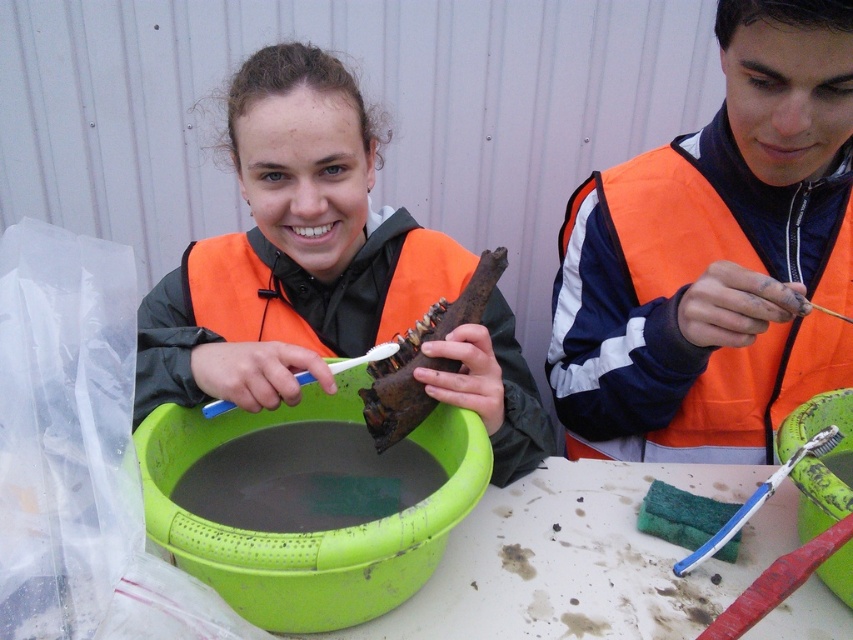
Does orange reflective vest at center appear over green plastic bowl at center?

Correct, orange reflective vest at center is located above green plastic bowl at center.

Find the location of a particular element. The width and height of the screenshot is (853, 640). orange reflective vest at center is located at coordinates (677, 298).

Is point (718, 230) positioned behind point (490, 282)?

Yes, it is.

Who is higher up, orange reflective vest at center or rusty metal lobster at center?

orange reflective vest at center

Is point (799, 403) closer to viewer compared to point (482, 305)?

That is False.

Where is `orange reflective vest at center`? The height and width of the screenshot is (640, 853). orange reflective vest at center is located at coordinates (677, 298).

This screenshot has width=853, height=640. Describe the element at coordinates (289, 250) in the screenshot. I see `matte orange vest at center` at that location.

Locate an element on the screen. matte orange vest at center is located at coordinates (289, 250).

At what (x,y) coordinates should I click in order to perform the action: click on matte orange vest at center. Please return your answer as a coordinate pair (x, y). Looking at the image, I should click on (289, 250).